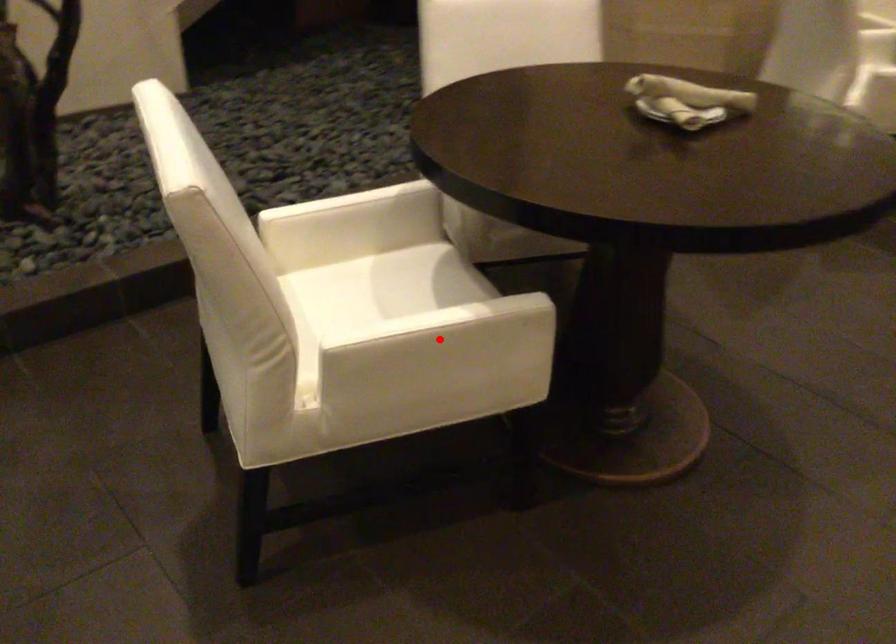
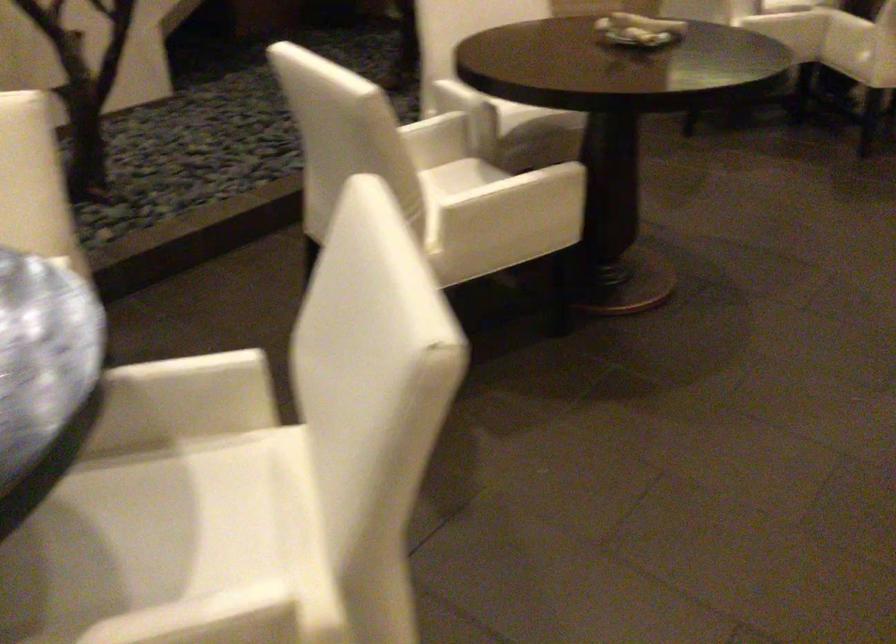
Locate, in the second image, the point that corresponds to the highlighted location in the first image.

(513, 196)